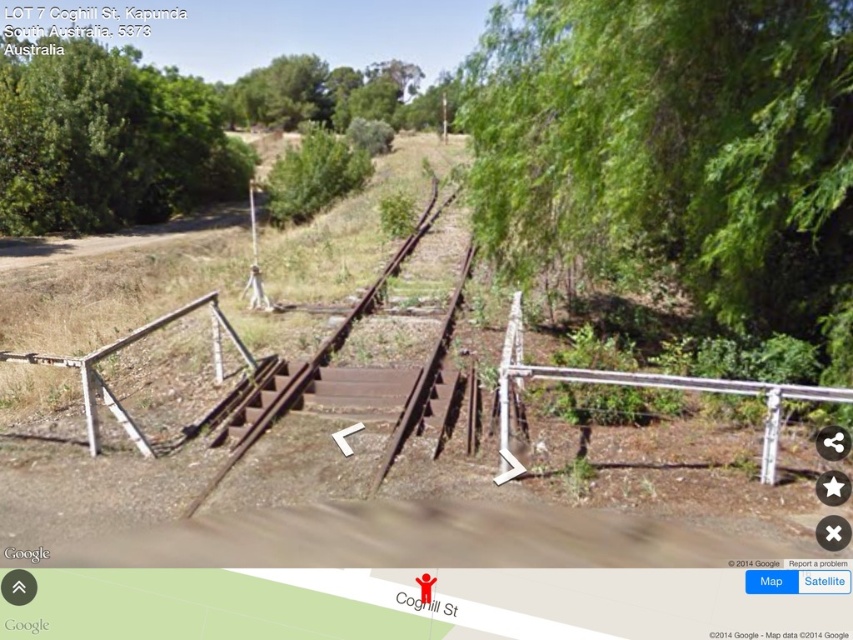
Question: Which point is farther from the camera taking this photo?

Choices:
 (A) (463, 269)
 (B) (97, 372)
 (C) (55, 124)

Answer: (C)

Question: Can you confirm if rusty metal stairs at center is smaller than rusty metal rail at lower left?

Choices:
 (A) yes
 (B) no

Answer: (A)

Question: Is green leafy tree at upper left bigger than rusty metal rail at lower left?

Choices:
 (A) yes
 (B) no

Answer: (A)

Question: Estimate the real-world distances between objects in this image. Which object is closer to the rusty metal rail at lower left?

Choices:
 (A) rusty metal train track at center
 (B) green leafy tree at upper left

Answer: (A)

Question: In this image, where is green leafy tree at upper left located relative to rusty metal train track at center?

Choices:
 (A) below
 (B) above

Answer: (B)

Question: Which of the following is the farthest from the observer?

Choices:
 (A) (199, 301)
 (B) (361, 296)
 (C) (358, 168)
 (D) (7, 147)

Answer: (C)